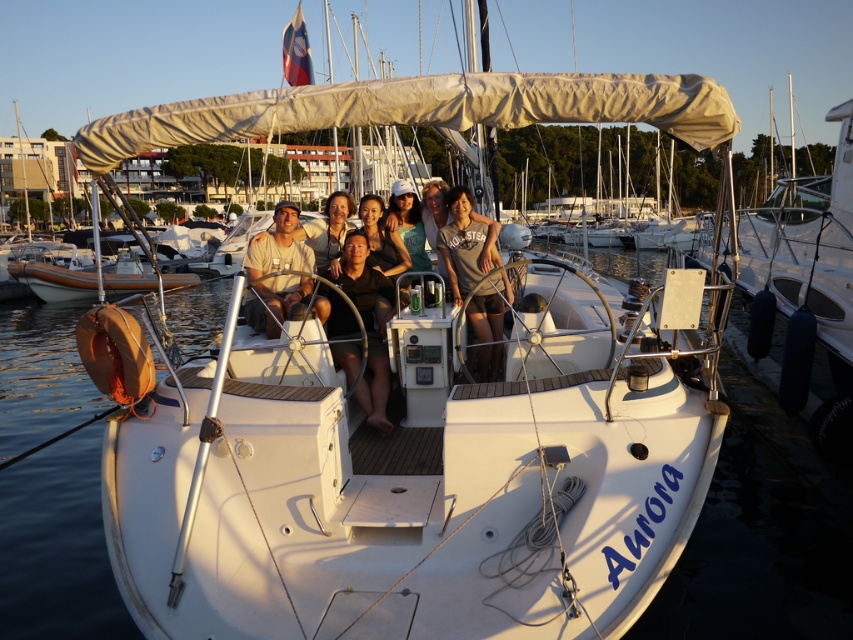
Question: Which of the following is the closest to the observer?

Choices:
 (A) (263, 301)
 (B) (126, 285)
 (C) (500, 284)

Answer: (A)

Question: Which of these objects is positioned closest to the matte beige shirt at center?

Choices:
 (A) black matte shirt at center
 (B) gray cotton shirt at center

Answer: (A)

Question: Can you confirm if white matte boat at right is wider than white matte boat at left?

Choices:
 (A) yes
 (B) no

Answer: (A)

Question: From the image, what is the correct spatial relationship of white matte boat at right in relation to black matte shirt at center?

Choices:
 (A) above
 (B) below

Answer: (A)

Question: Which point is farther to the camera?

Choices:
 (A) (283, 209)
 (B) (57, 278)
 (C) (387, 380)

Answer: (B)

Question: Does gray cotton shirt at center appear on the right side of matte beige shirt at center?

Choices:
 (A) yes
 (B) no

Answer: (A)